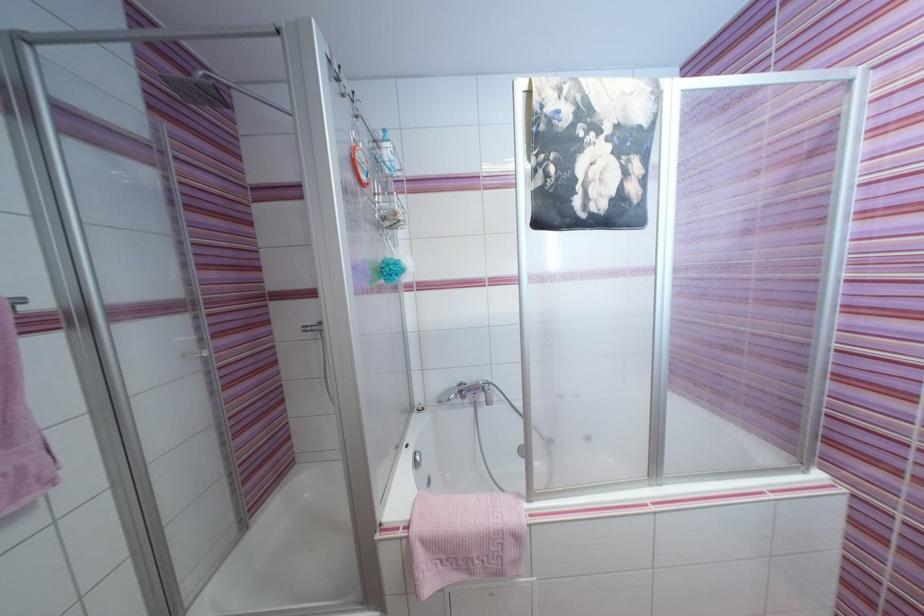
Where would you turn the silver faucet lever? Please return your answer as a coordinate pair (x, y).

(467, 391)